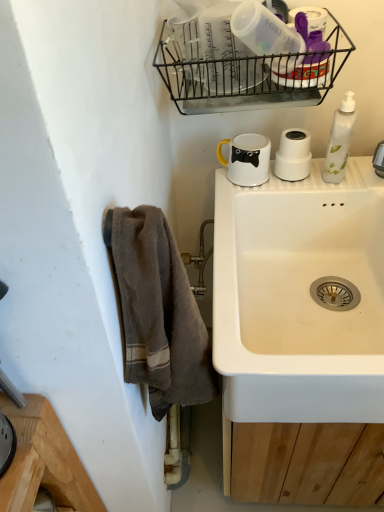
Question: From the image's perspective, is brown textured towel at left located above or below white glossy bottle at right?

Choices:
 (A) below
 (B) above

Answer: (A)

Question: Considering the positions of point (190, 339) and point (352, 118), is point (190, 339) closer or farther from the camera than point (352, 118)?

Choices:
 (A) closer
 (B) farther

Answer: (A)

Question: Which object is the closest to the white glossy mug at upper right?

Choices:
 (A) white ceramic sink at center
 (B) white matte cup at upper right, arranged as the 2th appliance when viewed from the top
 (C) white glossy bottle at right
 (D) brown textured towel at left
 (E) transparent plastic container at upper center, marked as the 1th appliance in a top-to-bottom arrangement

Answer: (B)

Question: Which is nearer to the transparent plastic container at upper center, which appears as the second appliance when viewed from the back?

Choices:
 (A) black wire basket at upper center
 (B) white glossy mug at upper right
 (C) white ceramic sink at center
 (D) white glossy bottle at right
 (E) white matte cup at upper right, which appears as the 1th appliance when viewed from the back

Answer: (A)